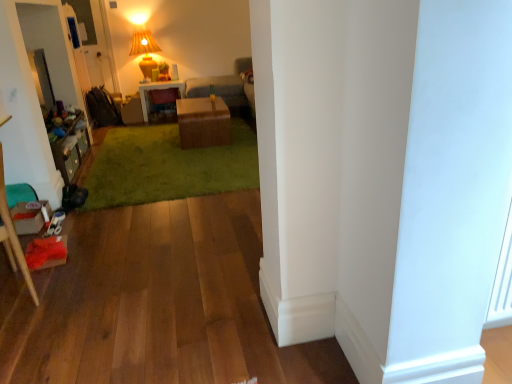
Question: Should I look upward or downward to see matte brown desk at center?

Choices:
 (A) up
 (B) down

Answer: (A)

Question: Does green plush carpet at center have a greater height compared to wooden dresser at left?

Choices:
 (A) yes
 (B) no

Answer: (B)

Question: Is green plush carpet at center at the right side of wooden dresser at left?

Choices:
 (A) yes
 (B) no

Answer: (A)

Question: From a real-world perspective, is green plush carpet at center physically below wooden dresser at left?

Choices:
 (A) no
 (B) yes

Answer: (B)

Question: Can you confirm if green plush carpet at center is bigger than wooden dresser at left?

Choices:
 (A) yes
 (B) no

Answer: (A)

Question: From the image's perspective, would you say green plush carpet at center is shown under wooden dresser at left?

Choices:
 (A) yes
 (B) no

Answer: (B)

Question: Does green plush carpet at center have a lesser height compared to wooden dresser at left?

Choices:
 (A) no
 (B) yes

Answer: (B)

Question: From a real-world perspective, is matte brown desk at center on matte yellow fabric lampshade at upper center?

Choices:
 (A) no
 (B) yes

Answer: (A)

Question: From the image's perspective, is matte brown desk at center beneath matte yellow fabric lampshade at upper center?

Choices:
 (A) yes
 (B) no

Answer: (A)

Question: Is matte brown desk at center facing away from matte yellow fabric lampshade at upper center?

Choices:
 (A) no
 (B) yes

Answer: (A)

Question: Does matte brown desk at center have a lesser width compared to matte yellow fabric lampshade at upper center?

Choices:
 (A) yes
 (B) no

Answer: (B)

Question: Is matte brown desk at center surrounding matte yellow fabric lampshade at upper center?

Choices:
 (A) yes
 (B) no

Answer: (B)

Question: Is matte brown desk at center outside matte yellow fabric lampshade at upper center?

Choices:
 (A) no
 (B) yes

Answer: (B)

Question: Would you say brown cardboard box at center is outside green plush carpet at center?

Choices:
 (A) yes
 (B) no

Answer: (A)